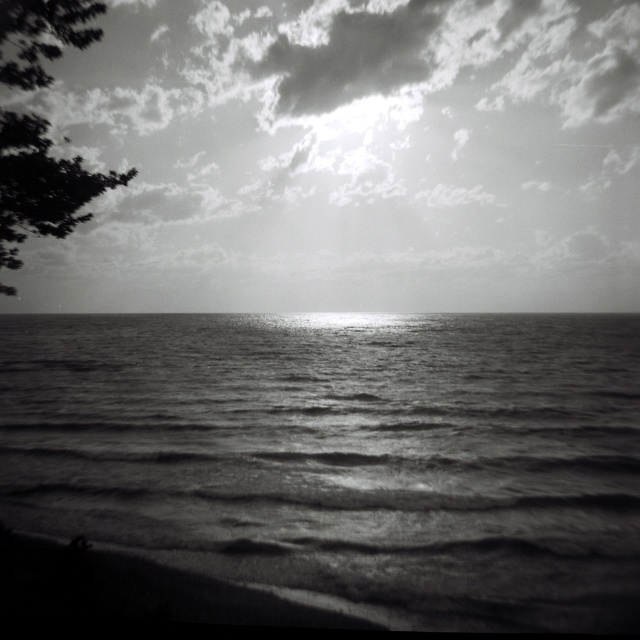
Question: Does cloudy sky at upper center have a lesser width compared to smooth water at center?

Choices:
 (A) yes
 (B) no

Answer: (B)

Question: Which point is farther to the camera?

Choices:
 (A) dark green leafy tree at upper left
 (B) cloudy sky at upper center
 (C) smooth water at center

Answer: (B)

Question: Does cloudy sky at upper center appear on the left side of smooth water at center?

Choices:
 (A) no
 (B) yes

Answer: (A)

Question: Is cloudy sky at upper center smaller than dark green leafy tree at upper left?

Choices:
 (A) yes
 (B) no

Answer: (B)

Question: Which point is farther from the camera taking this photo?

Choices:
 (A) click(x=20, y=179)
 (B) click(x=566, y=433)
 (C) click(x=234, y=144)

Answer: (C)

Question: Among these points, which one is farthest from the camera?

Choices:
 (A) (102, 250)
 (B) (632, 611)

Answer: (A)